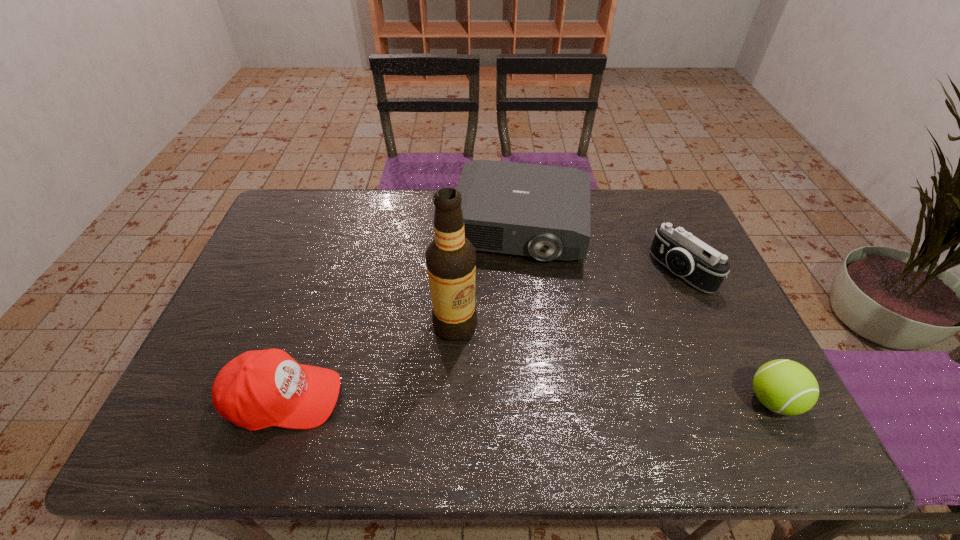
At what (x,y) coordinates should I click in order to perform the action: click on free space on the desktop that is between the leftmost object and the tennis ball and is positioned on the front-facing side of the projector. Please return your answer as a coordinate pair (x, y). Looking at the image, I should click on (491, 399).

Identify the location of free space on the desktop that is between the leftmost object and the tennis ball and is positioned on the front lens of the camera. The height and width of the screenshot is (540, 960). (474, 399).

Where is `vacant spot on the desktop that is between the baseball cap and the tennis ball and is positioned on the label of the tallest object`? The image size is (960, 540). vacant spot on the desktop that is between the baseball cap and the tennis ball and is positioned on the label of the tallest object is located at coordinates (472, 399).